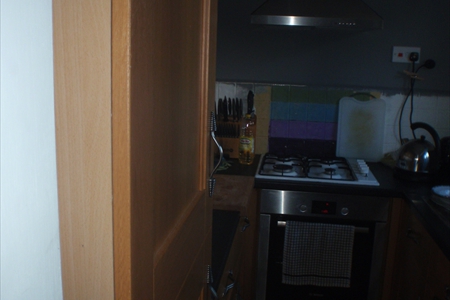
Locate an element on the screen. This screenshot has height=300, width=450. checkered dish towel is located at coordinates (340, 244).